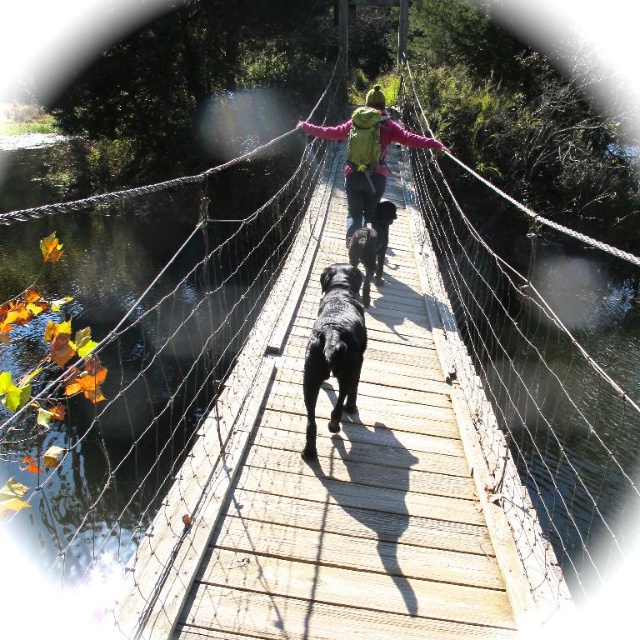
You are a delivery drone flying above the wooden suspension bridge. You need to land on the bridge to drop off a package. The green fabric backpack at center and the black matte dog at center are in your landing zone. Can you safely land between them if your drone requires a minimum of 30 inches of space?

The distance between the green fabric backpack at center and the black matte dog at center is 32.21 inches. Since the required minimum space is 30 inches, the drone can safely land between them.

You are standing on the wooden suspension bridge and notice two points marked on the bridge deck. The first point is at coordinates point (344,269) and the second point is at point (365,268). Which point is closer to you?

Point (344,269) is closer to the viewer than point (365,268).

You are standing on the wooden suspension bridge and see the shiny black dog at center and the green fabric backpack at center. Which object is nearer to you?

The shiny black dog at center is closer to the viewer than the green fabric backpack at center.